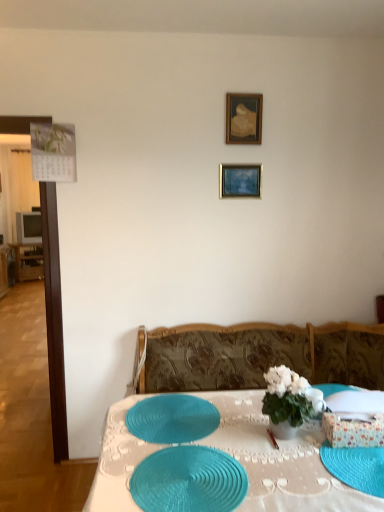
Find the location of a particular element. The width and height of the screenshot is (384, 512). vacant space to the left of blue textured glass plate at lower right is located at coordinates (290, 478).